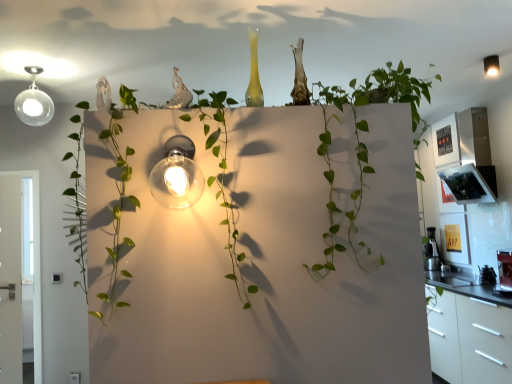
Question: In which direction should I rotate to look at clear glass light fixture at center, positioned as the second light fixture in back-to-front order?

Choices:
 (A) left
 (B) right

Answer: (A)

Question: Is matte black light fixture at upper right, which is counted as the second light fixture, starting from the bottom, positioned far away from clear glass light fixture at center, which appears as the 2th light fixture when viewed from the top?

Choices:
 (A) yes
 (B) no

Answer: (A)

Question: From the image's perspective, is matte black light fixture at upper right, placed as the first light fixture when sorted from top to bottom, over clear glass light fixture at center, which is the first light fixture in front-to-back order?

Choices:
 (A) no
 (B) yes

Answer: (B)

Question: Considering the relative sizes of matte black light fixture at upper right, which is counted as the second light fixture, starting from the left, and clear glass light fixture at center, the 1th light fixture viewed from the left, in the image provided, is matte black light fixture at upper right, which is counted as the second light fixture, starting from the left, thinner than clear glass light fixture at center, the 1th light fixture viewed from the left,?

Choices:
 (A) yes
 (B) no

Answer: (A)

Question: Does matte black light fixture at upper right, placed as the first light fixture when sorted from top to bottom, come behind clear glass light fixture at center, which is the first light fixture in front-to-back order?

Choices:
 (A) yes
 (B) no

Answer: (A)

Question: Considering the relative positions of matte black light fixture at upper right, marked as the 1th light fixture in a right-to-left arrangement, and clear glass light fixture at center, which appears as the 2th light fixture when viewed from the top, in the image provided, is matte black light fixture at upper right, marked as the 1th light fixture in a right-to-left arrangement, to the right of clear glass light fixture at center, which appears as the 2th light fixture when viewed from the top, from the viewer's perspective?

Choices:
 (A) yes
 (B) no

Answer: (A)

Question: Is matte black light fixture at upper right, which is counted as the second light fixture, starting from the bottom, turned away from clear glass light fixture at center, positioned as the second light fixture in back-to-front order?

Choices:
 (A) no
 (B) yes

Answer: (A)

Question: Is metallic silver coffee maker at right touching clear glass light fixture at center, the 1th light fixture from the bottom?

Choices:
 (A) no
 (B) yes

Answer: (A)

Question: From the image's perspective, is metallic silver coffee maker at right on clear glass light fixture at center, which is the first light fixture in front-to-back order?

Choices:
 (A) yes
 (B) no

Answer: (B)

Question: Is metallic silver coffee maker at right positioned beyond the bounds of clear glass light fixture at center, placed as the second light fixture when sorted from right to left?

Choices:
 (A) no
 (B) yes

Answer: (B)

Question: Would you consider metallic silver coffee maker at right to be distant from clear glass light fixture at center, which appears as the 2th light fixture when viewed from the top?

Choices:
 (A) yes
 (B) no

Answer: (A)

Question: Is metallic silver coffee maker at right further to the viewer compared to clear glass light fixture at center, which appears as the 2th light fixture when viewed from the top?

Choices:
 (A) no
 (B) yes

Answer: (B)

Question: Is the position of metallic silver coffee maker at right less distant than that of clear glass light fixture at center, which is the first light fixture in front-to-back order?

Choices:
 (A) no
 (B) yes

Answer: (A)

Question: Can you confirm if matte black light fixture at upper right, which is the 2th light fixture in front-to-back order, is positioned to the left of metallic silver coffee maker at right?

Choices:
 (A) no
 (B) yes

Answer: (B)